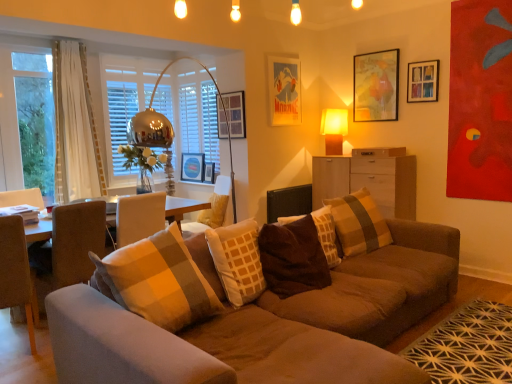
Question: Considering the positions of beige fabric armchair at center and wooden map at upper right, acting as the fifth picture frame starting from the left, in the image, is beige fabric armchair at center wider or thinner than wooden map at upper right, acting as the fifth picture frame starting from the left,?

Choices:
 (A) thin
 (B) wide

Answer: (B)

Question: Is beige fabric armchair at center bigger or smaller than wooden map at upper right, acting as the fifth picture frame starting from the left?

Choices:
 (A) small
 (B) big

Answer: (B)

Question: Which object is positioned farthest from the brown fuzzy pillow at center, marked as the first pillow in a front-to-back arrangement?

Choices:
 (A) light brown wood cabinet at center right
 (B) beige fabric armchair at center
 (C) light brown wood chair at left
 (D) brown fabric swivel chair at left
 (E) wooden map at upper right, acting as the fifth picture frame starting from the left

Answer: (E)

Question: Which of these objects is positioned farthest from the brown fabric swivel chair at left?

Choices:
 (A) wooden map at upper right, acting as the fifth picture frame starting from the left
 (B) light brown wood cabinet at center right
 (C) plaid fabric pillow at center, the 1th pillow viewed from the back
 (D) wooden picture frame at upper right, which ranks as the 1th picture frame in right-to-left order
 (E) white wood drawer at center

Answer: (D)